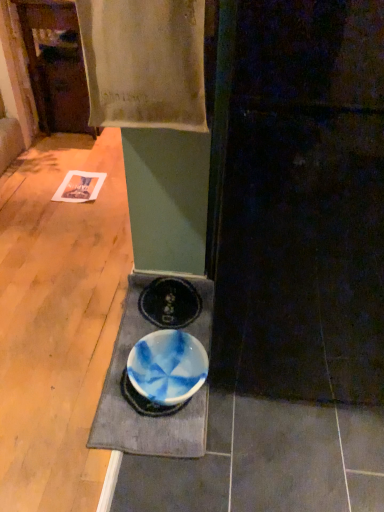
The height and width of the screenshot is (512, 384). I want to click on vacant region in front of blue glazed bowl at lower center, so click(163, 477).